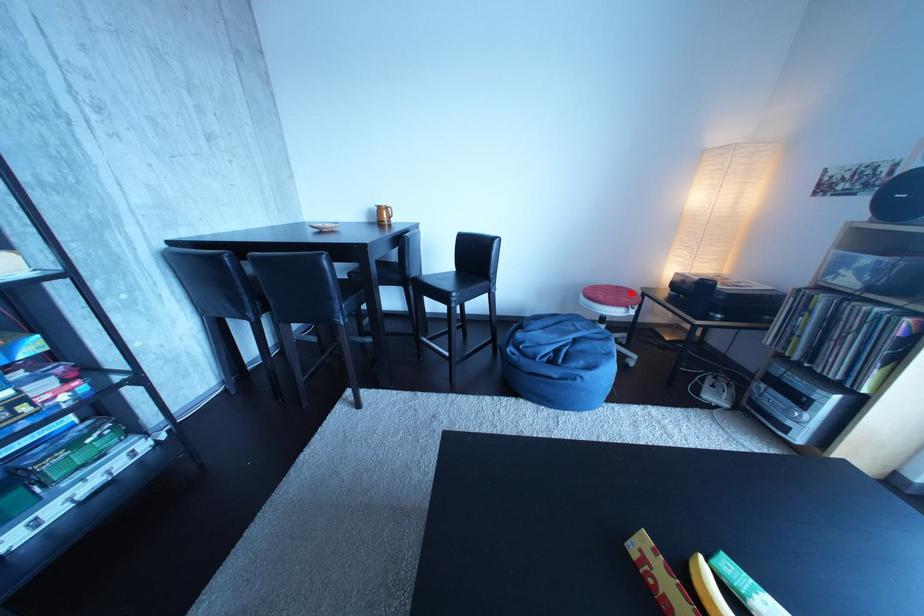
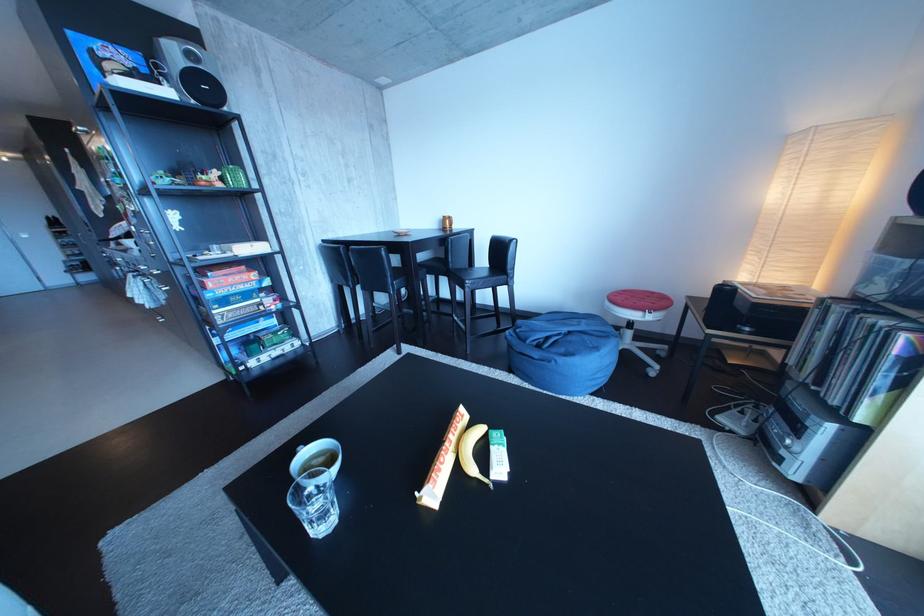
Locate, in the second image, the point that corresponds to the highlighted location in the first image.

(666, 299)